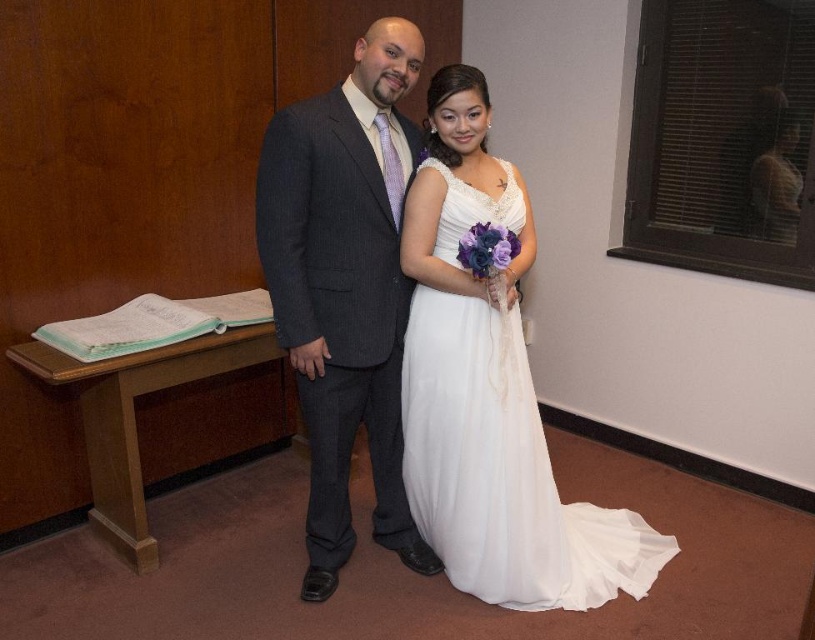
Question: Which point is closer to the camera taking this photo?

Choices:
 (A) (349, 394)
 (B) (487, 436)

Answer: (B)

Question: Which object is farther from the camera taking this photo?

Choices:
 (A) white chiffon dress at center
 (B) dark gray pinstripe suit at center
 (C) white satin dress at center

Answer: (A)

Question: Is white satin dress at center above white chiffon dress at center?

Choices:
 (A) no
 (B) yes

Answer: (A)

Question: Is white satin dress at center to the left of dark gray pinstripe suit at center from the viewer's perspective?

Choices:
 (A) yes
 (B) no

Answer: (B)

Question: Which object is farther from the camera taking this photo?

Choices:
 (A) white chiffon dress at center
 (B) dark gray pinstripe suit at center
 (C) white satin dress at center

Answer: (A)

Question: Is dark gray pinstripe suit at center wider than white chiffon dress at center?

Choices:
 (A) no
 (B) yes

Answer: (A)